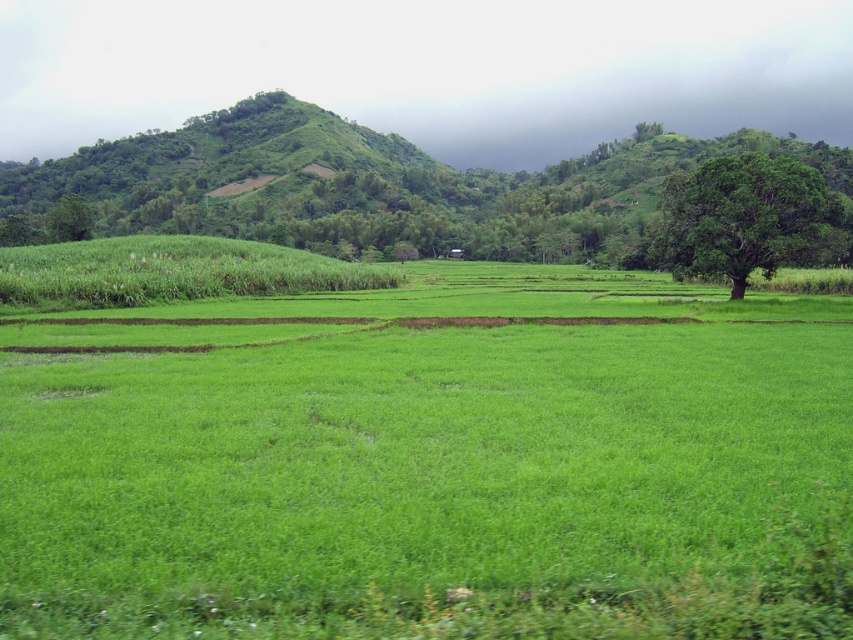
Question: Considering the relative positions of green grassy field at center and green leafy tree at right in the image provided, where is green grassy field at center located with respect to green leafy tree at right?

Choices:
 (A) above
 (B) below

Answer: (B)

Question: Is green grassy field at center to the right of green leafy hillside at left from the viewer's perspective?

Choices:
 (A) no
 (B) yes

Answer: (B)

Question: Which object appears closest to the camera in this image?

Choices:
 (A) green leafy hillside at left
 (B) green leafy tree at right
 (C) green leafy tree at left

Answer: (B)

Question: Does green grassy field at center have a smaller size compared to green leafy tree at right?

Choices:
 (A) no
 (B) yes

Answer: (B)

Question: Which object appears farthest from the camera in this image?

Choices:
 (A) green leafy hillside at left
 (B) green leafy tree at left
 (C) green grassy field at center

Answer: (B)

Question: Among these points, which one is nearest to the camera?

Choices:
 (A) (28, 240)
 (B) (717, 216)

Answer: (B)